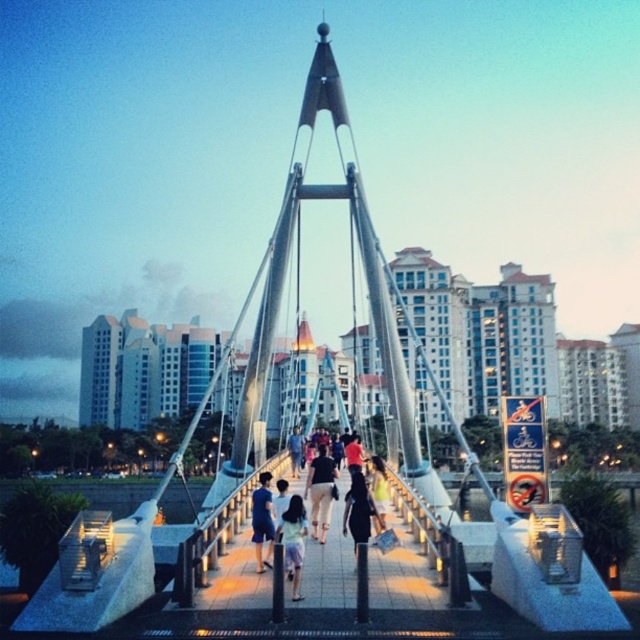
Question: Which point is closer to the camera?

Choices:
 (A) black fabric dress at center
 (B) light blue fabric dress at center
 (C) blue denim jeans at center
 (D) light beige pants at center

Answer: (B)

Question: Among these objects, which one is nearest to the camera?

Choices:
 (A) light blue fabric dress at center
 (B) black fabric dress at center
 (C) light beige pants at center
 (D) light brown fabric dress at center

Answer: (A)

Question: Does light beige pants at center appear over light brown fabric dress at center?

Choices:
 (A) no
 (B) yes

Answer: (B)

Question: Is light brown fabric dress at center positioned behind blue denim jeans at center?

Choices:
 (A) no
 (B) yes

Answer: (A)

Question: Is smooth concrete walkway at center bigger than black fabric dress at center?

Choices:
 (A) no
 (B) yes

Answer: (B)

Question: Which point is farther to the camera?

Choices:
 (A) light brown fabric dress at center
 (B) smooth concrete walkway at center
 (C) blue denim jeans at center
 (D) black fabric dress at center

Answer: (C)